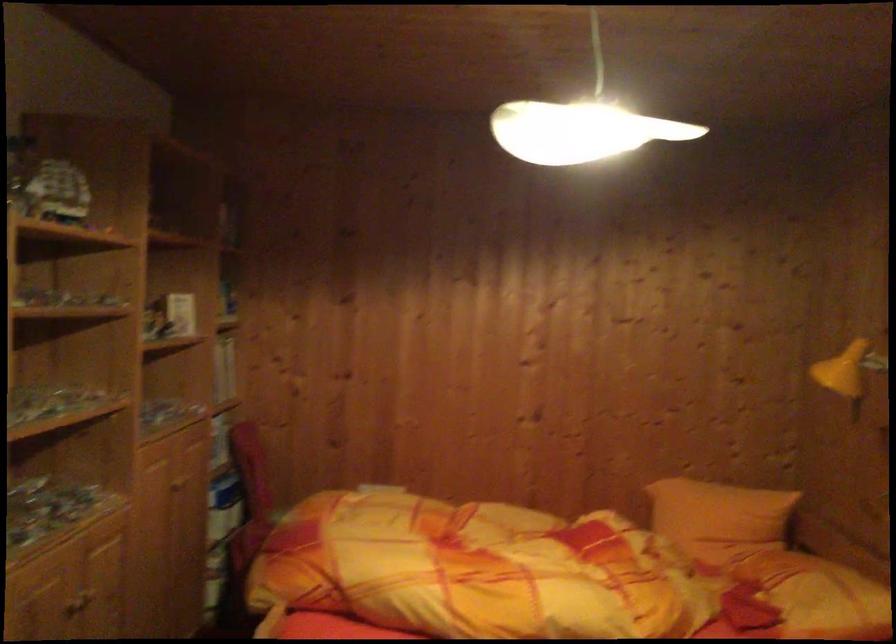
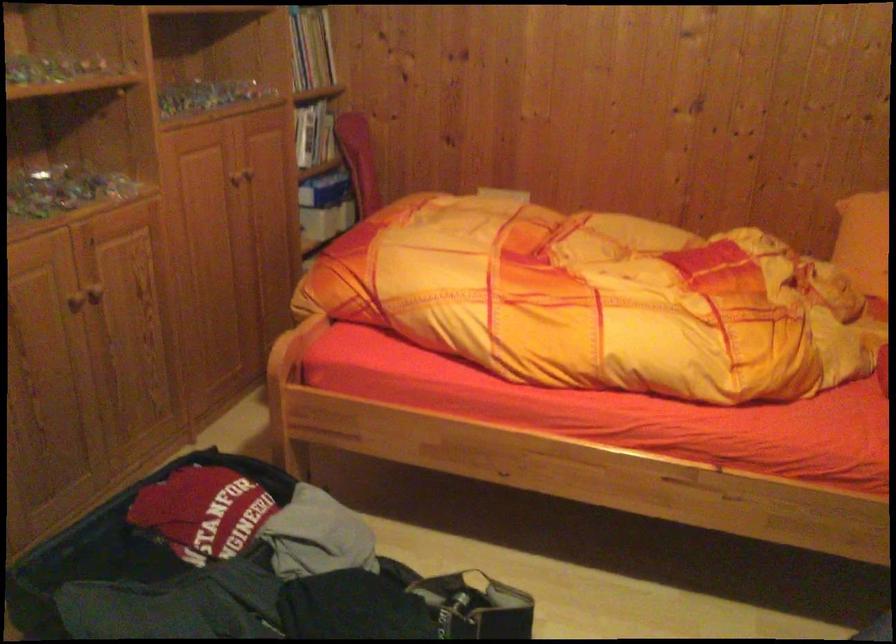
Based on the photo, first-person continuous shooting, in which direction is the camera rotating?

The rotation direction of the camera is left-down.